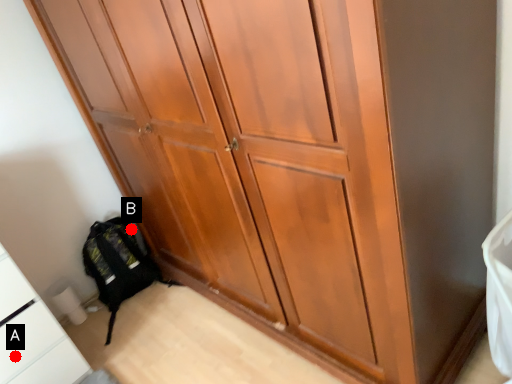
Question: Two points are circled on the image, labeled by A and B beside each circle. Among these points, which one is farthest from the camera?

Choices:
 (A) A is further
 (B) B is further

Answer: (B)